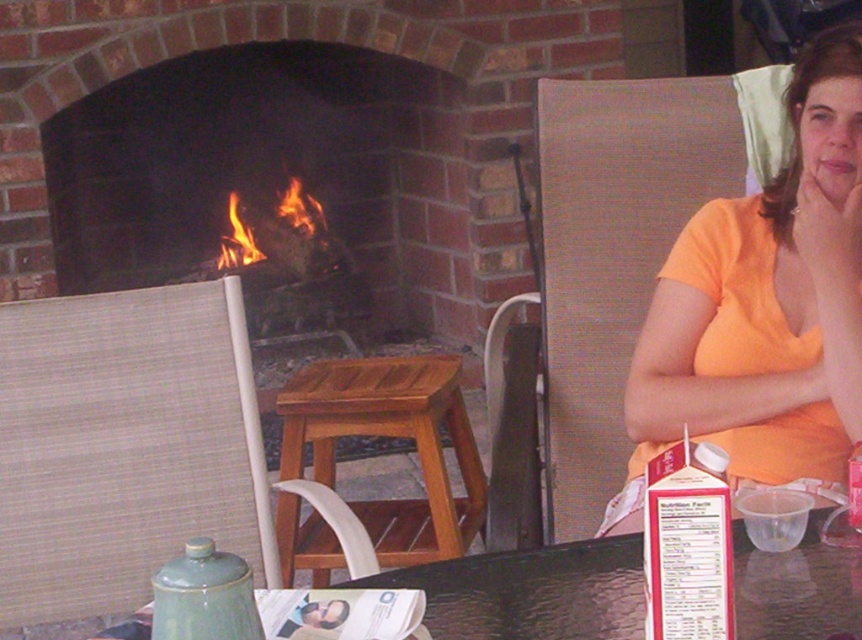
Question: Estimate the real-world distances between objects in this image. Which object is farther from the orange cotton shirt at upper right?

Choices:
 (A) black glossy table at lower center
 (B) wooden stool at center

Answer: (B)

Question: Is orange cotton shirt at upper right to the right of black glossy table at lower center from the viewer's perspective?

Choices:
 (A) yes
 (B) no

Answer: (A)

Question: Based on their relative distances, which object is farther from the orange cotton shirt at upper right?

Choices:
 (A) flamewooden" at "center
 (B) black glossy table at lower center
 (C) wooden stool at center

Answer: (A)

Question: Is orange cotton shirt at upper right smaller than black glossy table at lower center?

Choices:
 (A) yes
 (B) no

Answer: (B)

Question: Which object appears closest to the camera in this image?

Choices:
 (A) black glossy table at lower center
 (B) orange cotton shirt at upper right

Answer: (A)

Question: Is orange cotton shirt at upper right bigger than wooden stool at center?

Choices:
 (A) no
 (B) yes

Answer: (A)